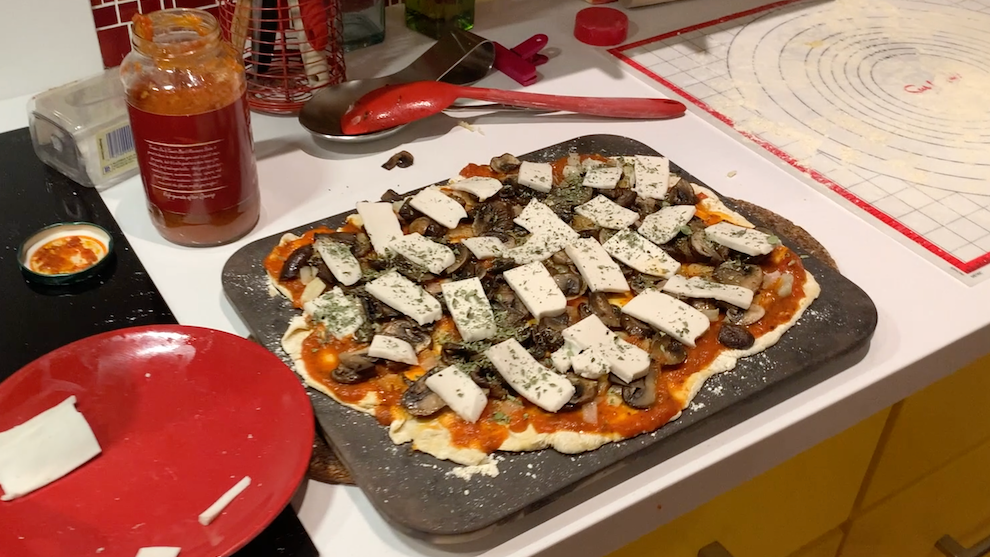
Find the location of a particular element. Image resolution: width=990 pixels, height=557 pixels. jar lid is located at coordinates (70, 244).